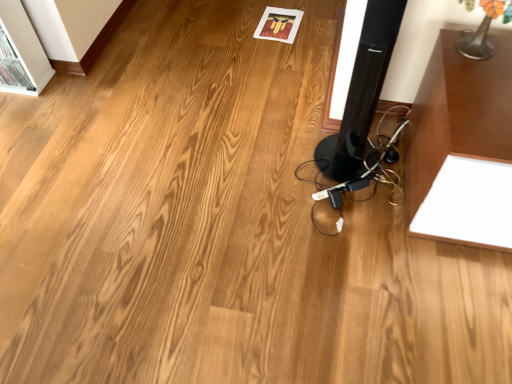
You are a GUI agent. You are given a task and a screenshot of the screen. Output one action in this format:
    pyautogui.click(x=<x>, y=<y>)
    Task: Click on the free spot behind black glossy speaker at center
    The width and height of the screenshot is (512, 384).
    Given the screenshot: What is the action you would take?
    click(321, 117)